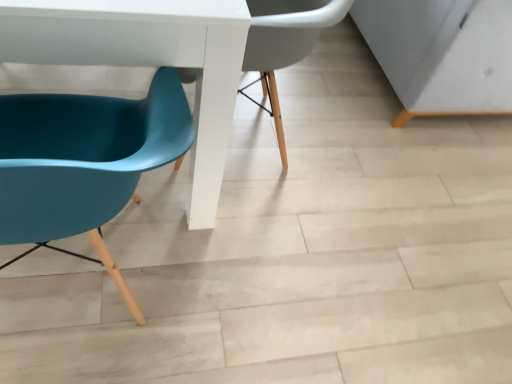
Question: Is teal plastic chair at left, the second chair when ordered from bottom to top, to the left of teal plastic chair at left, arranged as the 1th chair when ordered from the bottom, from the viewer's perspective?

Choices:
 (A) yes
 (B) no

Answer: (B)

Question: Can you confirm if teal plastic chair at left, the second chair when ordered from bottom to top, is taller than teal plastic chair at left, arranged as the 1th chair when ordered from the bottom?

Choices:
 (A) yes
 (B) no

Answer: (B)

Question: Is teal plastic chair at left, the 1th chair viewed from the top, outside of teal plastic chair at left, the second chair from the top?

Choices:
 (A) no
 (B) yes

Answer: (B)

Question: From a real-world perspective, is teal plastic chair at left, the 1th chair viewed from the top, located beneath teal plastic chair at left, arranged as the 1th chair when ordered from the bottom?

Choices:
 (A) no
 (B) yes

Answer: (B)

Question: Does teal plastic chair at left, the 1th chair viewed from the top, have a larger size compared to teal plastic chair at left, the second chair from the top?

Choices:
 (A) no
 (B) yes

Answer: (B)

Question: From the image's perspective, is teal plastic chair at left, the second chair when ordered from bottom to top, located above teal plastic chair at left, arranged as the 1th chair when ordered from the bottom?

Choices:
 (A) yes
 (B) no

Answer: (A)

Question: From the image's perspective, is white glossy table at lower left on top of teal plastic chair at left, arranged as the 1th chair when ordered from the bottom?

Choices:
 (A) no
 (B) yes

Answer: (B)

Question: Considering the relative positions of white glossy table at lower left and teal plastic chair at left, the second chair from the top, in the image provided, is white glossy table at lower left to the right of teal plastic chair at left, the second chair from the top, from the viewer's perspective?

Choices:
 (A) yes
 (B) no

Answer: (B)

Question: Is teal plastic chair at left, arranged as the 1th chair when ordered from the bottom, completely or partially inside white glossy table at lower left?

Choices:
 (A) no
 (B) yes

Answer: (A)

Question: Considering the relative sizes of white glossy table at lower left and teal plastic chair at left, arranged as the 1th chair when ordered from the bottom, in the image provided, is white glossy table at lower left wider than teal plastic chair at left, arranged as the 1th chair when ordered from the bottom,?

Choices:
 (A) yes
 (B) no

Answer: (A)

Question: Is teal plastic chair at left, arranged as the 1th chair when ordered from the bottom, at the back of white glossy table at lower left?

Choices:
 (A) yes
 (B) no

Answer: (B)

Question: Is white glossy table at lower left bigger than teal plastic chair at left, the second chair from the top?

Choices:
 (A) yes
 (B) no

Answer: (A)

Question: Is white glossy table at lower left surrounding teal plastic chair at left, the 1th chair viewed from the top?

Choices:
 (A) no
 (B) yes

Answer: (B)